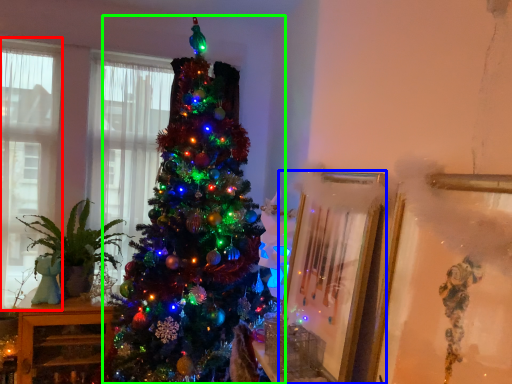
Question: Estimate the real-world distances between objects in this image. Which object is closer to window (highlighted by a red box), picture frame (highlighted by a blue box) or christmas tree (highlighted by a green box)?

Choices:
 (A) picture frame
 (B) christmas tree

Answer: (B)